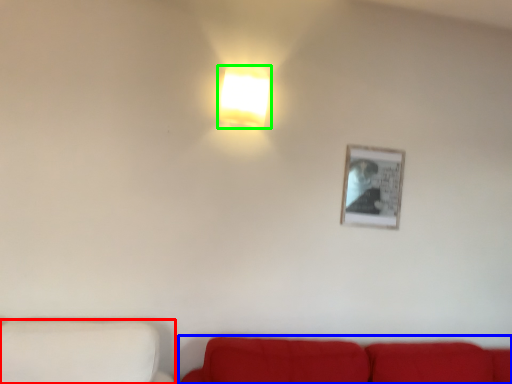
Question: Considering the real-world distances, which object is farthest from furniture (highlighted by a red box)? studio couch (highlighted by a blue box) or lamp (highlighted by a green box)?

Choices:
 (A) studio couch
 (B) lamp

Answer: (B)